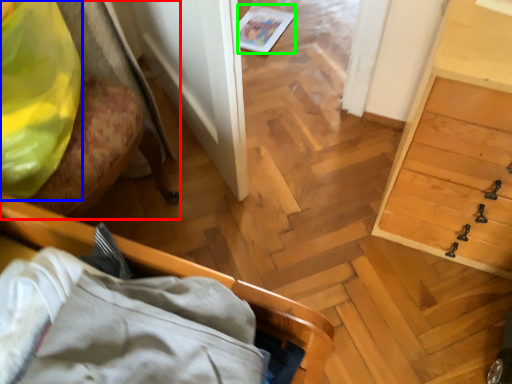
Question: Which is farther away from furniture (highlighted by a red box)? clothing (highlighted by a blue box) or magazine (highlighted by a green box)?

Choices:
 (A) clothing
 (B) magazine

Answer: (B)